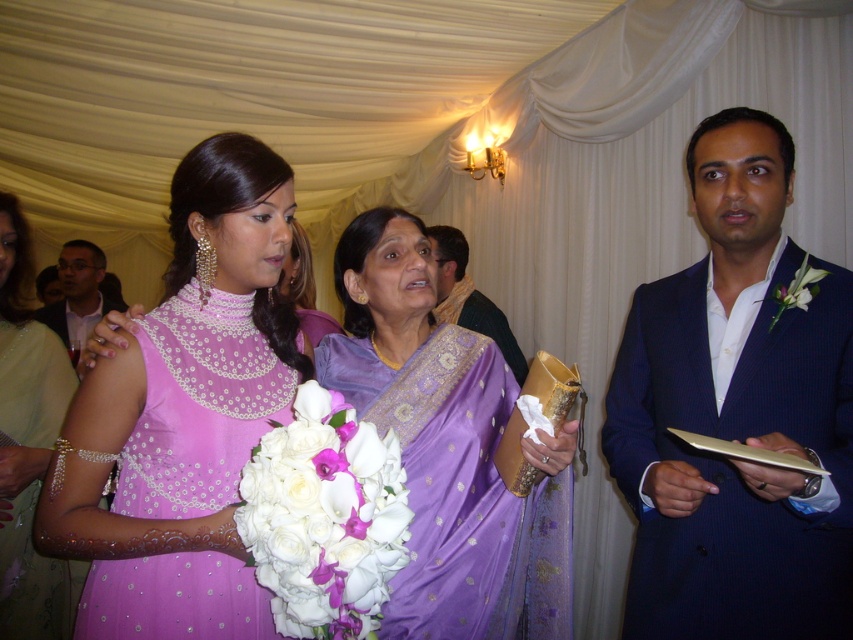
Between pink beaded dress at center and white silk boutonniere at right, which one appears on the left side from the viewer's perspective?

From the viewer's perspective, pink beaded dress at center appears more on the left side.

Can you confirm if pink beaded dress at center is bigger than white silk boutonniere at right?

Yes.

Looking at this image, who is more distant from viewer, (36, 333) or (770, 321)?

Point (36, 333)

Identify the location of pink beaded dress at center. (28, 448).

Can you confirm if purple satin saree at center is smaller than matte black suit at left?

Correct, purple satin saree at center occupies less space than matte black suit at left.

Can you confirm if purple satin saree at center is wider than matte black suit at left?

Yes.

Locate an element on the screen. The image size is (853, 640). purple satin saree at center is located at coordinates click(x=184, y=412).

Identify the location of purple satin saree at center. (184, 412).

Does pink satin dress at center appear on the right side of matte black suit at left?

Indeed, pink satin dress at center is positioned on the right side of matte black suit at left.

Is pink satin dress at center thinner than matte black suit at left?

Correct, pink satin dress at center's width is less than matte black suit at left's.

Is point (79, 634) positioned in front of point (67, 244)?

Yes, it is.

Find the location of a particular element. This screenshot has width=853, height=640. pink satin dress at center is located at coordinates (199, 404).